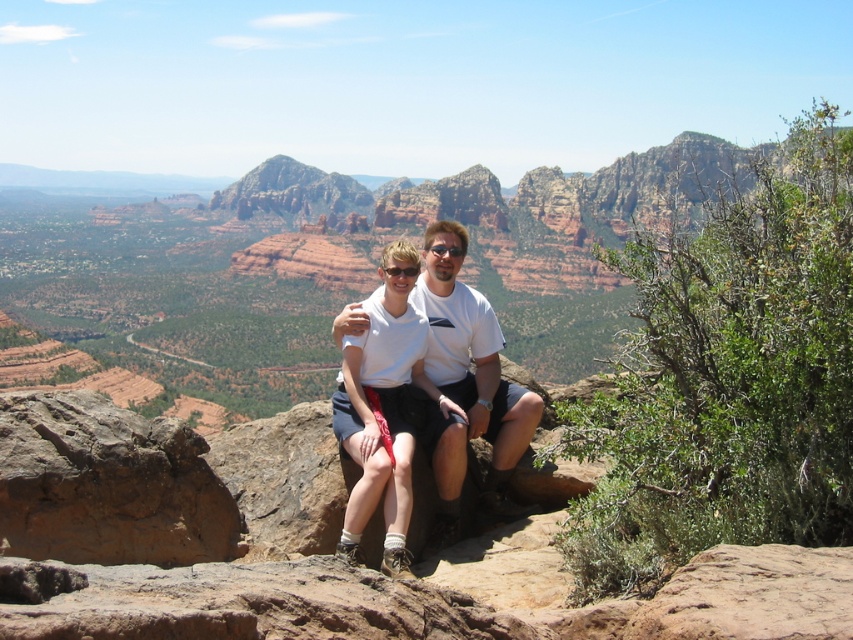
You are planning to take a photo of the brown rough rock at lower left and the white cotton shirt at center. Which object should you focus on first if you want to capture both in the same frame without moving the camera?

The brown rough rock at lower left should be focused on first since it is smaller in size compared to the white cotton shirt at center, allowing you to adjust the framing to include both objects.

Consider the image. You are standing at the base of the rocky outcrop in the image and want to reach the first point you see. Which point would you head towards, point (61, 481) or point (456, 419)?

You should head towards point (61, 481) because it is in front of point (456, 419) from your current position at the base of the rocky outcrop.

You are a photographer planning to take a picture of the scene described in the scene. You want to ensure that the brown rough rock at lower left is positioned exactly at the center of the image. Given that the image coordinate system has its origin at the bottom left corner, with x increasing to the right and y increasing upwards, what adjustment should you make to the camera position to achieve this?

To center the brown rough rock at lower left at its current 2D location of point (107, 484), the camera should be adjusted so that the rock is moved towards the center coordinates of the image. Since the image coordinate system has the origin at the bottom left, the center would be at point (426, 320). Therefore, the camera should be moved upwards to increase the y coordinate and to the left to decrease the x coordinate until the rock reaches the center point.